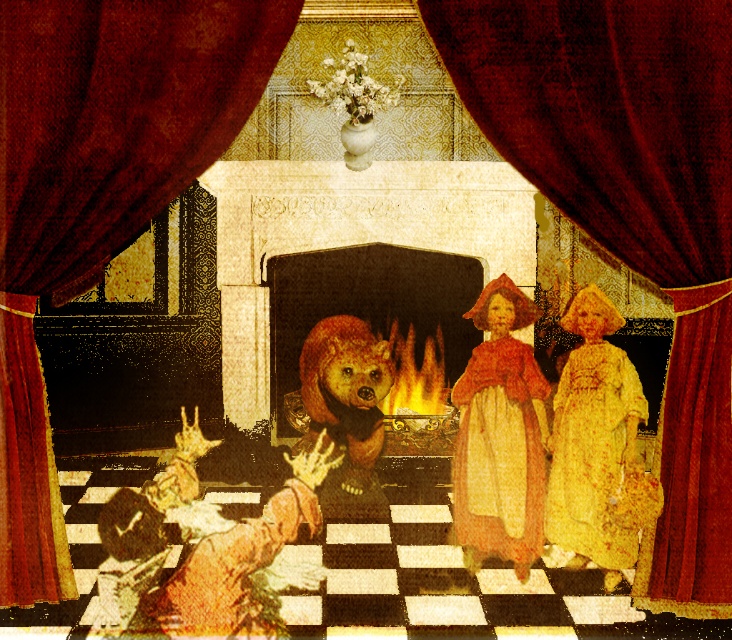
Question: Is marble fireplace at center in front of smooth stone fireplace at center?

Choices:
 (A) no
 (B) yes

Answer: (B)

Question: Does velvet curtain at right have a greater width compared to marble fireplace at center?

Choices:
 (A) yes
 (B) no

Answer: (B)

Question: Which point is farther to the camera?

Choices:
 (A) (283, 305)
 (B) (632, 193)
 (C) (597, 387)

Answer: (A)

Question: Among these objects, which one is nearest to the camera?

Choices:
 (A) velvet yellow dress at center
 (B) yellow floral fabric dress at center

Answer: (B)

Question: Is the position of velvet curtain at right less distant than that of velvet curtain at left?

Choices:
 (A) yes
 (B) no

Answer: (B)

Question: Which of these objects is positioned farthest from the yellow floral fabric dress at center?

Choices:
 (A) velvet curtain at right
 (B) velvet yellow dress at center

Answer: (A)